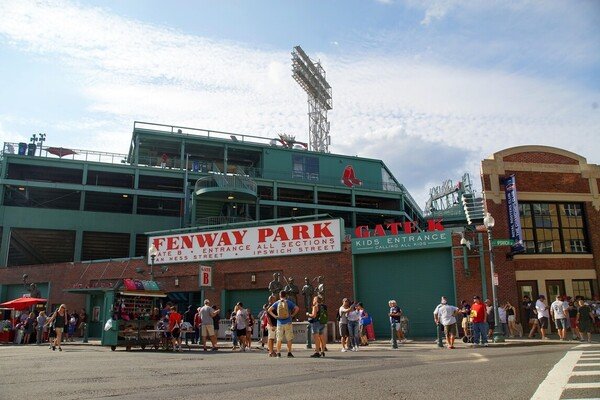
This screenshot has height=400, width=600. I want to click on lights, so (309, 69).